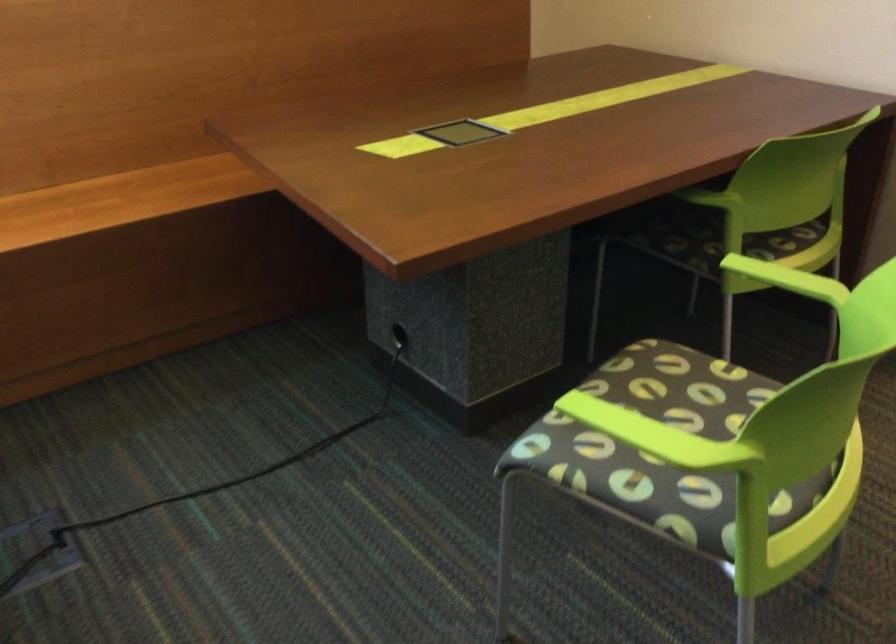
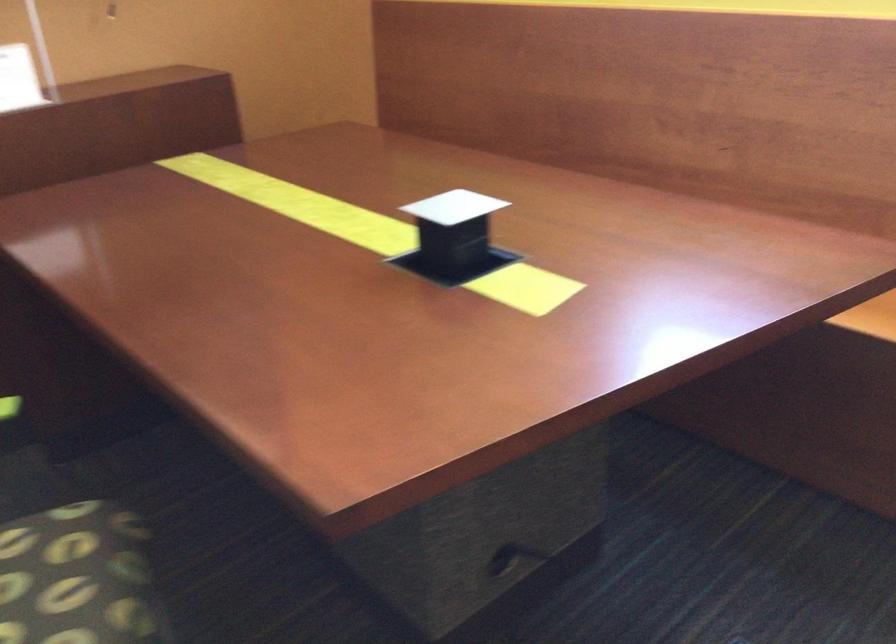
First-person continuous shooting, in which direction is the camera rotating?

The camera's rotation is toward left-down.